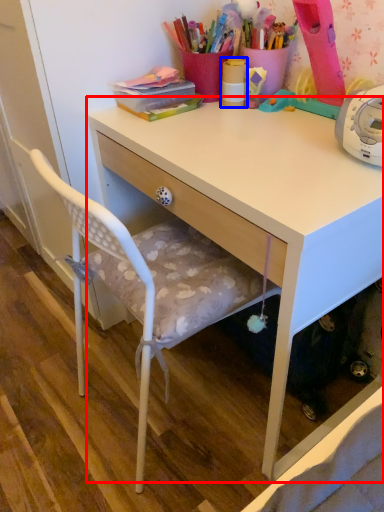
Question: Which object is closer to the camera taking this photo, desk (highlighted by a red box) or office supplies (highlighted by a blue box)?

Choices:
 (A) desk
 (B) office supplies

Answer: (A)